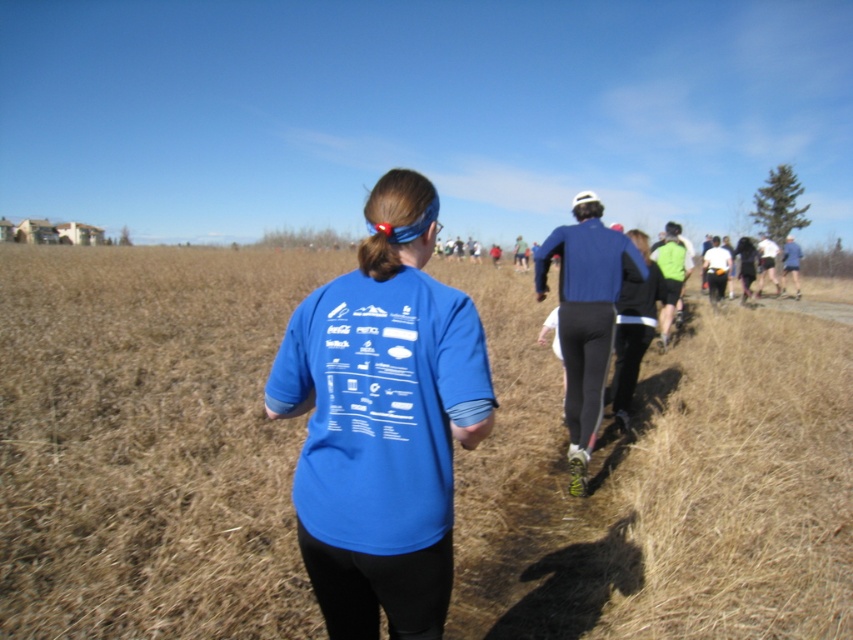
Is brown dry grass at center taller than matte blue t-shirt at center?

Yes.

Is brown dry grass at center smaller than matte blue t-shirt at center?

Incorrect, brown dry grass at center is not smaller in size than matte blue t-shirt at center.

Between point (604, 449) and point (364, 502), which one is positioned behind?

The point (604, 449) is behind.

Image resolution: width=853 pixels, height=640 pixels. Find the location of `brown dry grass at center`. brown dry grass at center is located at coordinates (148, 442).

Based on the photo, can you confirm if brown dry grass at center is positioned to the right of blue fabric jacket at center?

In fact, brown dry grass at center is to the left of blue fabric jacket at center.

Does point (112, 291) lie in front of point (578, 372)?

No, it is not.

Does point (608, 552) lie in front of point (544, 291)?

Yes, it is in front of point (544, 291).

You are a GUI agent. You are given a task and a screenshot of the screen. Output one action in this format:
    pyautogui.click(x=<x>, y=<y>)
    Task: Click on the brown dry grass at center
    
    Given the screenshot: What is the action you would take?
    pyautogui.click(x=148, y=442)

Which is above, matte blue t-shirt at center or blue fabric jacket at center?

blue fabric jacket at center is higher up.

Is matte blue t-shirt at center smaller than blue fabric jacket at center?

Yes, matte blue t-shirt at center is smaller than blue fabric jacket at center.

Is point (412, 616) positioned behind point (596, 211)?

No, (412, 616) is in front of (596, 211).

You are a GUI agent. You are given a task and a screenshot of the screen. Output one action in this format:
    pyautogui.click(x=<x>, y=<y>)
    Task: Click on the matte blue t-shirt at center
    Image resolution: width=853 pixels, height=640 pixels.
    Given the screenshot: What is the action you would take?
    pyautogui.click(x=381, y=420)